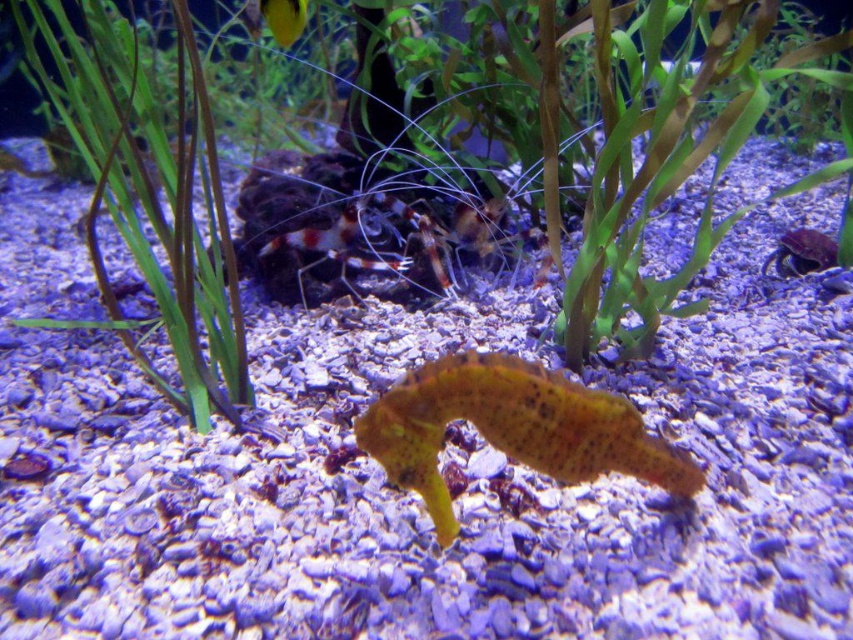
From the picture: Can you confirm if smooth purple crab at right is positioned above shiny yellow fish at upper center?

Actually, smooth purple crab at right is below shiny yellow fish at upper center.

Who is shorter, smooth purple crab at right or shiny yellow fish at upper center?

With less height is shiny yellow fish at upper center.

Who is more distant from viewer, (x=796, y=260) or (x=299, y=13)?

The point (x=796, y=260) is more distant.

The width and height of the screenshot is (853, 640). What are the coordinates of `smooth purple crab at right` in the screenshot? It's located at (802, 252).

Is yellow textured seahorse at center smaller than smooth purple crab at right?

Actually, yellow textured seahorse at center might be larger than smooth purple crab at right.

Which is behind, point (498, 451) or point (790, 256)?

The point (790, 256) is more distant.

Between point (398, 410) and point (785, 273), which one is positioned in front?

Positioned in front is point (398, 410).

The height and width of the screenshot is (640, 853). Find the location of `yellow textured seahorse at center`. yellow textured seahorse at center is located at coordinates (511, 428).

Does green leafy plant at center have a lesser height compared to smooth purple crab at right?

No, green leafy plant at center is not shorter than smooth purple crab at right.

The width and height of the screenshot is (853, 640). Find the location of `green leafy plant at center`. green leafy plant at center is located at coordinates (148, 196).